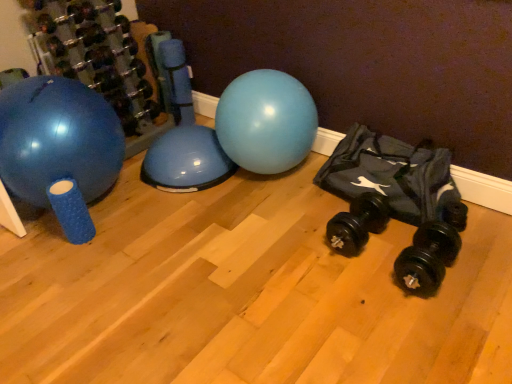
Question: Considering the positions of black rubber dumbbell at lower right, the second dumbbell viewed from the front, and blue rubber ball at left in the image, is black rubber dumbbell at lower right, the second dumbbell viewed from the front, wider or thinner than blue rubber ball at left?

Choices:
 (A) thin
 (B) wide

Answer: (A)

Question: Considering the positions of black rubber dumbbell at lower right, acting as the 2th dumbbell starting from the back, and blue rubber ball at left in the image, is black rubber dumbbell at lower right, acting as the 2th dumbbell starting from the back, taller or shorter than blue rubber ball at left?

Choices:
 (A) tall
 (B) short

Answer: (B)

Question: Estimate the real-world distances between objects in this image. Which object is closer to the black rubber dumbbell at lower right, the 3th dumbbell when ordered from left to right?

Choices:
 (A) black rubber dumbbell at left, the third dumbbell ordered from the bottom
 (B) black fabric bean bag at right
 (C) black rubber dumbbell at lower right, acting as the second dumbbell starting from the right
 (D) blue rubber ball at left

Answer: (C)

Question: Estimate the real-world distances between objects in this image. Which object is farther from the black fabric bean bag at right?

Choices:
 (A) black rubber dumbbell at lower right, positioned as the 2th dumbbell in bottom-to-top order
 (B) blue rubber ball at left
 (C) black rubber dumbbell at lower right, which ranks as the first dumbbell in front-to-back order
 (D) black rubber dumbbell at left, the first dumbbell positioned from the top

Answer: (D)